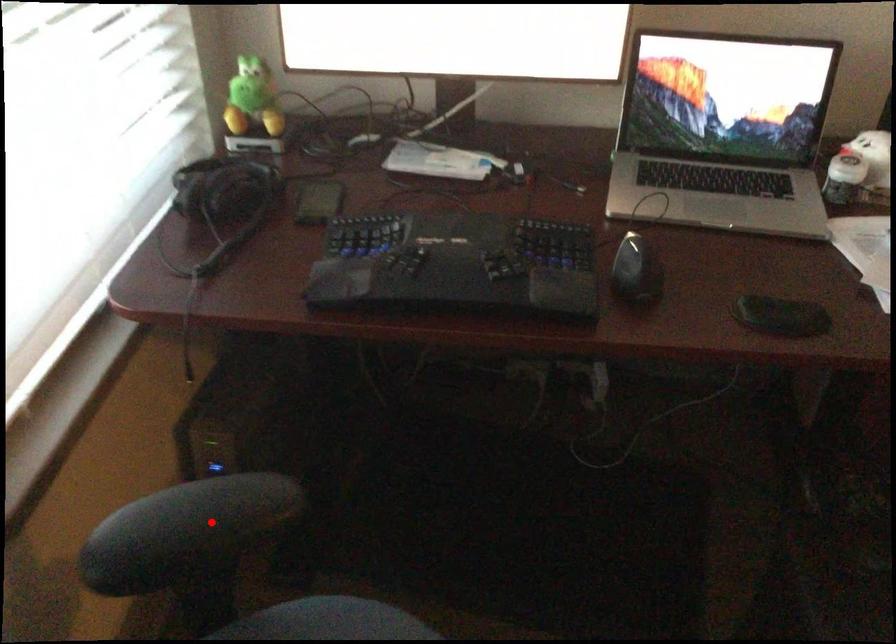
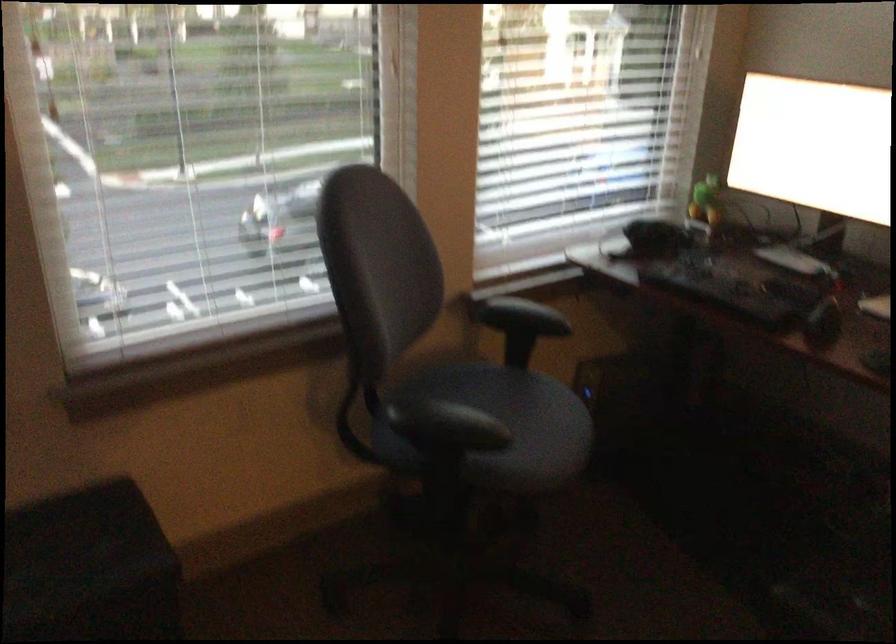
Question: A red point is marked in image1. In image2, is the corresponding 3D point closer to the camera or farther? Reply with the corresponding letter.

Choices:
 (A) The corresponding 3D point is closer.
 (B) The corresponding 3D point is farther.

Answer: (B)